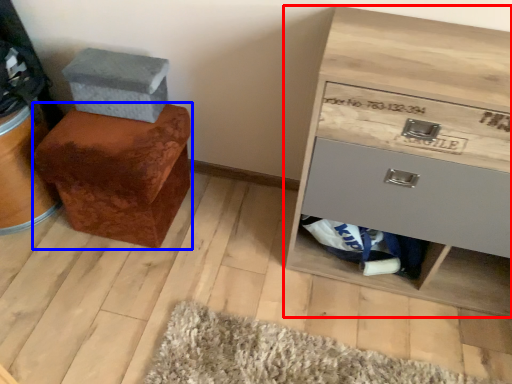
Question: Which point is further to the camera, chest of drawers (highlighted by a red box) or furniture (highlighted by a blue box)?

Choices:
 (A) chest of drawers
 (B) furniture

Answer: (B)